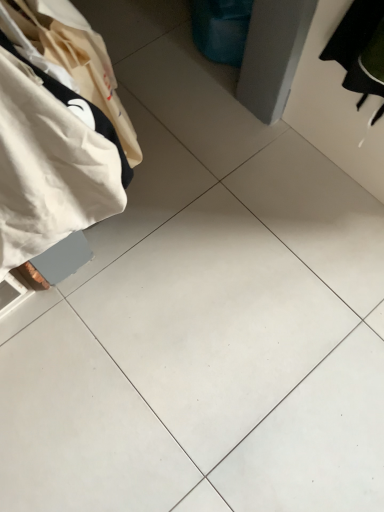
The width and height of the screenshot is (384, 512). Identify the location of free point below white fabric bag at left (from a real-world perspective). (100, 289).